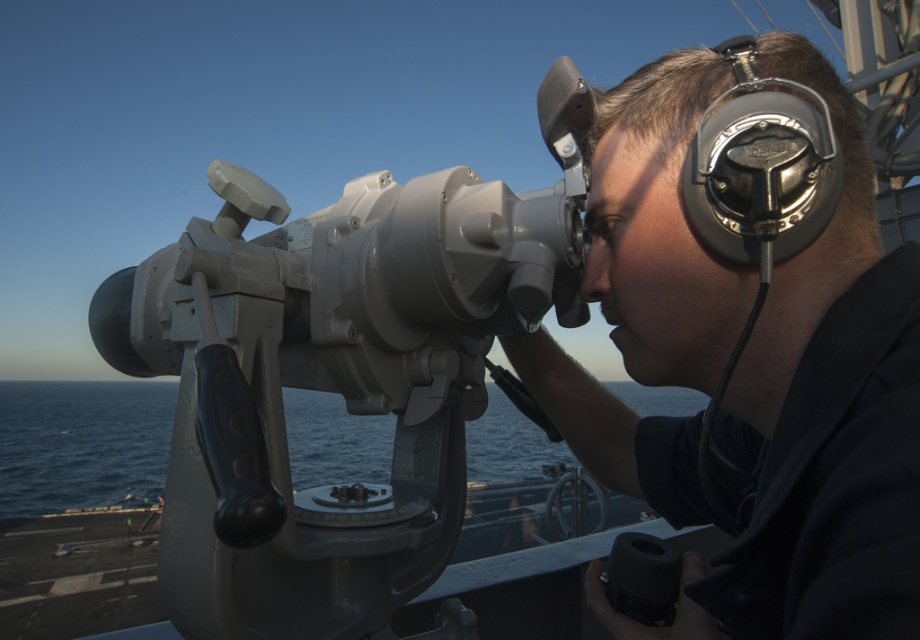
Question: Can you confirm if blue water at lower left is thinner than metallic/reflective headset at upper right?

Choices:
 (A) yes
 (B) no

Answer: (B)

Question: Which point is farther from the camera taking this photo?

Choices:
 (A) (608, 138)
 (B) (825, 212)
 (C) (75, 387)

Answer: (C)

Question: Can you confirm if metallic gray binoculars at center is thinner than blue water at lower left?

Choices:
 (A) yes
 (B) no

Answer: (A)

Question: Which of the following is the farthest from the observer?

Choices:
 (A) (725, 304)
 (B) (359, 429)

Answer: (B)

Question: Is blue water at lower left bigger than metallic/reflective headset at upper right?

Choices:
 (A) no
 (B) yes

Answer: (B)

Question: Which of the following is the closest to the observer?

Choices:
 (A) (530, 456)
 (B) (709, 292)
 (C) (775, 243)

Answer: (C)